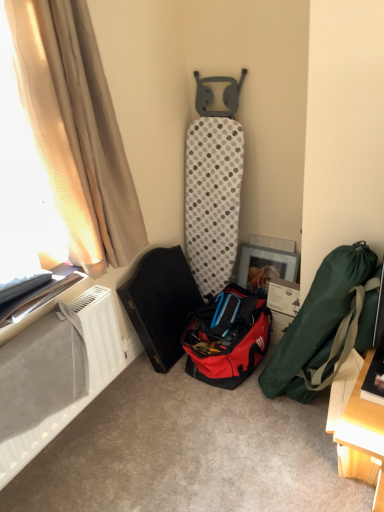
Question: Would you say red fabric bag at center, the 1th luggage and bags in the left-to-right sequence, is part of translucent beige curtain at left's contents?

Choices:
 (A) no
 (B) yes

Answer: (A)

Question: Can you confirm if translucent beige curtain at left is bigger than red fabric bag at center, which is the second luggage and bags in right-to-left order?

Choices:
 (A) no
 (B) yes

Answer: (B)

Question: Considering the relative positions of translucent beige curtain at left and red fabric bag at center, which is the second luggage and bags in right-to-left order, in the image provided, is translucent beige curtain at left to the right of red fabric bag at center, which is the second luggage and bags in right-to-left order, from the viewer's perspective?

Choices:
 (A) no
 (B) yes

Answer: (A)

Question: Is the position of translucent beige curtain at left more distant than that of red fabric bag at center, which is the second luggage and bags in right-to-left order?

Choices:
 (A) yes
 (B) no

Answer: (B)

Question: Considering the relative sizes of translucent beige curtain at left and red fabric bag at center, which is the second luggage and bags in right-to-left order, in the image provided, is translucent beige curtain at left taller than red fabric bag at center, which is the second luggage and bags in right-to-left order,?

Choices:
 (A) yes
 (B) no

Answer: (A)

Question: Looking at the image, does translucent beige curtain at left seem bigger or smaller compared to white plastic radiator at lower left?

Choices:
 (A) big
 (B) small

Answer: (A)

Question: From a real-world perspective, is translucent beige curtain at left physically located above or below white plastic radiator at lower left?

Choices:
 (A) below
 (B) above

Answer: (B)

Question: Which is correct: translucent beige curtain at left is inside white plastic radiator at lower left, or outside of it?

Choices:
 (A) inside
 (B) outside

Answer: (B)

Question: Is point (21, 128) closer or farther from the camera than point (57, 346)?

Choices:
 (A) farther
 (B) closer

Answer: (A)

Question: From their relative heights in the image, would you say beige fabric curtain at left is taller or shorter than white plastic radiator at lower left?

Choices:
 (A) short
 (B) tall

Answer: (B)

Question: From the image's perspective, is beige fabric curtain at left located above or below white plastic radiator at lower left?

Choices:
 (A) below
 (B) above

Answer: (B)

Question: From a real-world perspective, relative to white plastic radiator at lower left, is beige fabric curtain at left vertically above or below?

Choices:
 (A) above
 (B) below

Answer: (A)

Question: Would you say beige fabric curtain at left is inside or outside white plastic radiator at lower left?

Choices:
 (A) outside
 (B) inside

Answer: (A)

Question: Is green fabric bag at right, which is the 2th luggage and bags from left to right, taller or shorter than white plastic radiator at lower left?

Choices:
 (A) short
 (B) tall

Answer: (B)

Question: From the image's perspective, is green fabric bag at right, which is the 2th luggage and bags from left to right, above or below white plastic radiator at lower left?

Choices:
 (A) below
 (B) above

Answer: (B)